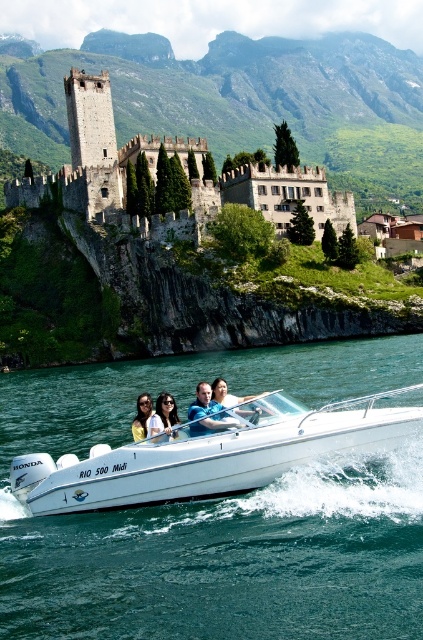
Consider the image. You are a passenger on the Honda RIO 500 Midi speedboat and want to know where the clear blue water at boat front is located. Can you describe its position relative to the boat?

The clear blue water at boat front is located at the coordinates point (217, 513) relative to the boat.

You are a passenger on the boat and want to see the clear blue water at boat front without leaning forward. Can you see it while looking straight ahead at the smooth skin face at center?

The clear blue water at boat front is below the smooth skin face at center, so you can see it by looking down towards the water while keeping your head straight.

You are a tour guide on the Honda Rio 500 Midi boat. A tourist asks if they can safely throw a small floating toy from the boat front to the center where the matte black sunglasses are. The toy floats best in clear blue water. Considering the distance between the clear blue water at boat front and the matte black sunglasses at center, would the toy reach the sunglasses area?

The clear blue water at boat front and the matte black sunglasses at center are 44.37 feet apart. Since the toy floats best in clear blue water, it can travel the distance of 44.37 feet, so yes, the toy would reach the sunglasses area.